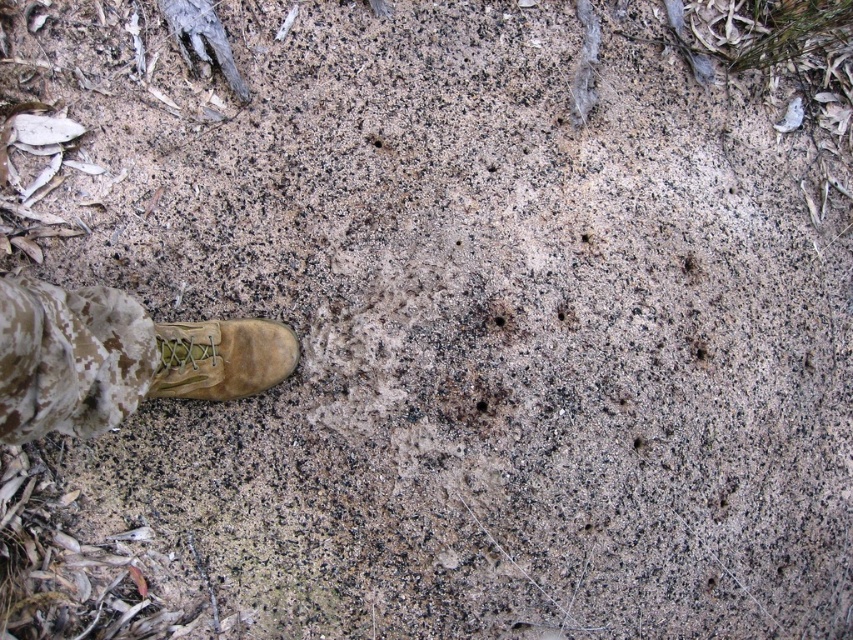
You are a hiker who has just stepped onto the sandy ground with your tan suede boot at lower left. You notice a camouflage fabric at lower left nearby. Which object is taller when viewed from above?

The camouflage fabric at lower left is much taller than the tan suede boot at lower left.

You are standing on the sandy ground and see the camouflage fabric at lower left and the tan suede boot at lower left. Which object is nearer to you?

The camouflage fabric at lower left is closer to the viewer than the tan suede boot at lower left.

You are a photographer setting up equipment on the sandy ground. You have a camouflage fabric at lower left. Where exactly should you place your tripod to avoid covering the camouflage fabric? Please provide coordinates in the format of a point like this example format of point format like this example format of point format like this example format of point format like this example format of point format like this example format of point format like this example format of point format like this example of

The camouflage fabric at lower left is located at point (68, 358), so place the tripod away from that coordinate to avoid covering it.